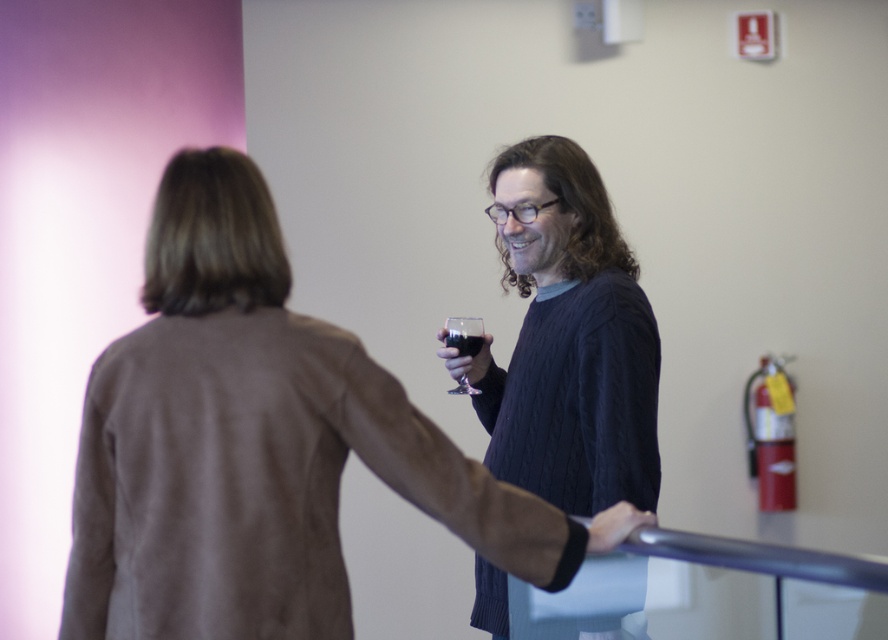
You are standing in the hallway and want to reach the point closer to you. Which of the two points, point (343, 577) or point (525, 292), should you head towards?

You should head towards point (343, 577) because it is closer to the viewer than point (525, 292).

You are a delivery person carrying a box that is 30 cm wide. You need to walk through a narrow corridor where the brown suede jacket at center and the knitted sweater at center are hanging on a rack. Can your box fit through the space between them?

The brown suede jacket at center might be wider than knitted sweater at center. Since the jacket could be wider, the space between them may not be sufficient for a 30 cm wide box. Check the actual width before proceeding.

You are standing at point (480, 342) and want to walk to point (581, 456). Are you moving forward or backward?

Moving forward because point (581, 456) is in front of point (480, 342).